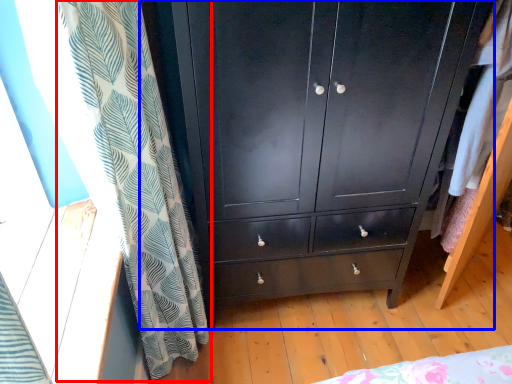
Question: Which point is closer to the camera, curtain (highlighted by a red box) or chest of drawers (highlighted by a blue box)?

Choices:
 (A) curtain
 (B) chest of drawers

Answer: (A)